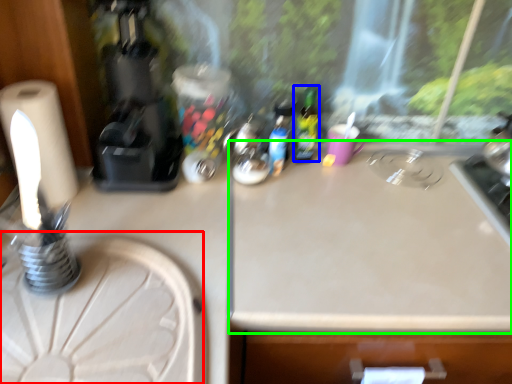
Question: Based on their relative distances, which object is farther from round table (highlighted by a red box)? Choose from bottle (highlighted by a blue box) and counter top (highlighted by a green box).

Choices:
 (A) bottle
 (B) counter top

Answer: (A)